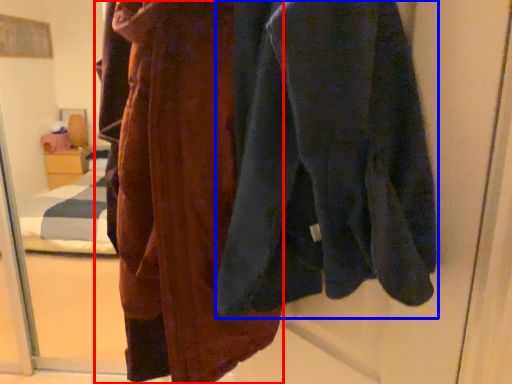
Question: Which of the following is the farthest to the observer, fancy dress (highlighted by a red box) or sweatshirt (highlighted by a blue box)?

Choices:
 (A) fancy dress
 (B) sweatshirt

Answer: (A)